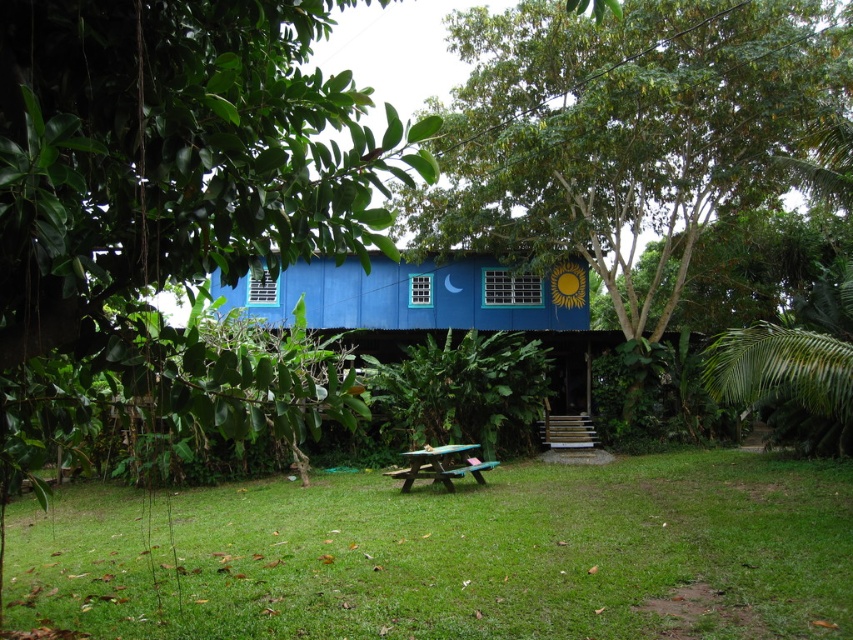
The image size is (853, 640). What do you see at coordinates (416, 296) in the screenshot?
I see `blue painted wood hut at center` at bounding box center [416, 296].

Is point (372, 308) closer to camera compared to point (445, 464)?

No, (372, 308) is behind (445, 464).

Is point (564, 301) farther from camera compared to point (469, 461)?

Yes, point (564, 301) is behind point (469, 461).

You are a GUI agent. You are given a task and a screenshot of the screen. Output one action in this format:
    pyautogui.click(x=<x>, y=<y>)
    Task: Click on the blue painted wood hut at center
    Image resolution: width=853 pixels, height=640 pixels.
    Given the screenshot: What is the action you would take?
    pyautogui.click(x=416, y=296)

Does green leafy tree at center appear on the right side of wooden picnic table at center?

Indeed, green leafy tree at center is positioned on the right side of wooden picnic table at center.

Between point (450, 45) and point (450, 472), which one is positioned behind?

Point (450, 45)

At what (x,y) coordinates should I click in order to perform the action: click on green leafy tree at center. Please return your answer as a coordinate pair (x, y). The width and height of the screenshot is (853, 640). Looking at the image, I should click on (633, 140).

Is green grass at center thinner than green leafy tree at center?

Incorrect, green grass at center's width is not less than green leafy tree at center's.

Can you confirm if green grass at center is shorter than green leafy tree at center?

Indeed, green grass at center has a lesser height compared to green leafy tree at center.

In order to click on green grass at center in this screenshot , I will do `click(451, 554)`.